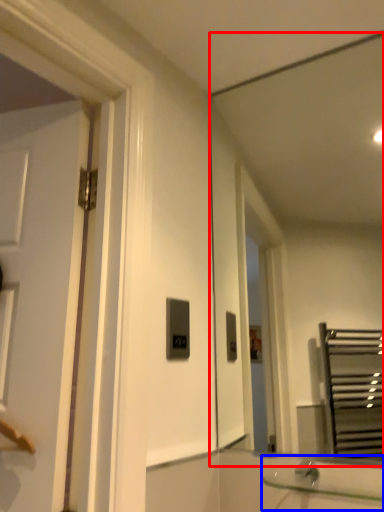
Question: Which of the following is the closest to the observer, mirror (highlighted by a red box) or sink (highlighted by a blue box)?

Choices:
 (A) mirror
 (B) sink

Answer: (B)